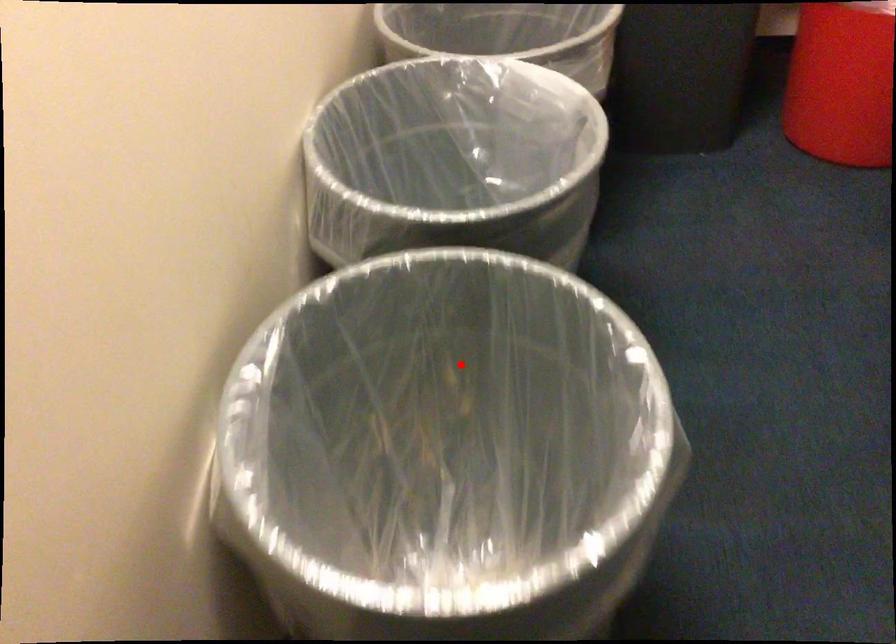
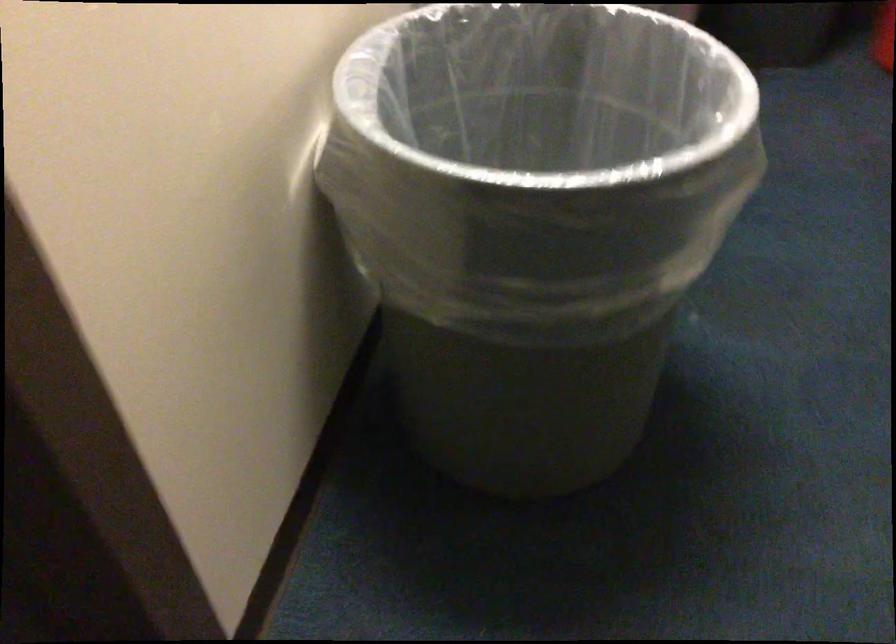
Locate, in the second image, the point that corresponds to the highlighted location in the first image.

(538, 136)